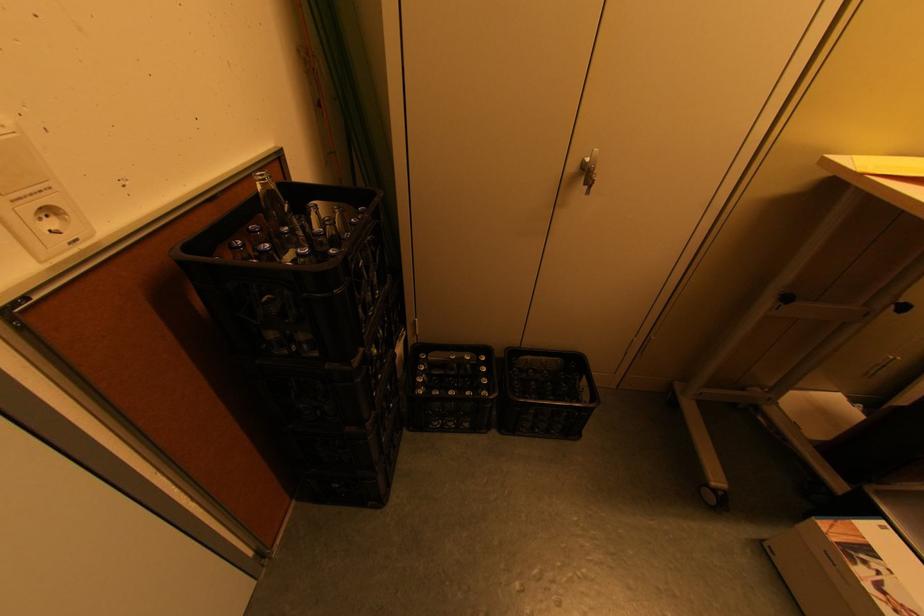
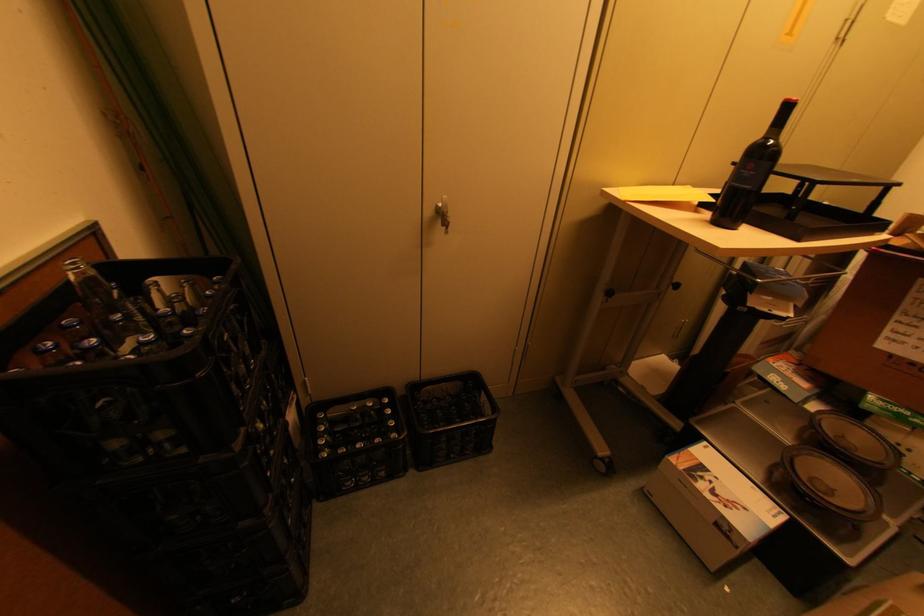
Question: The first image is from the beginning of the video and the second image is from the end. How did the camera likely rotate when shooting the video?

Choices:
 (A) Left
 (B) Right
 (C) Up
 (D) Down

Answer: (B)